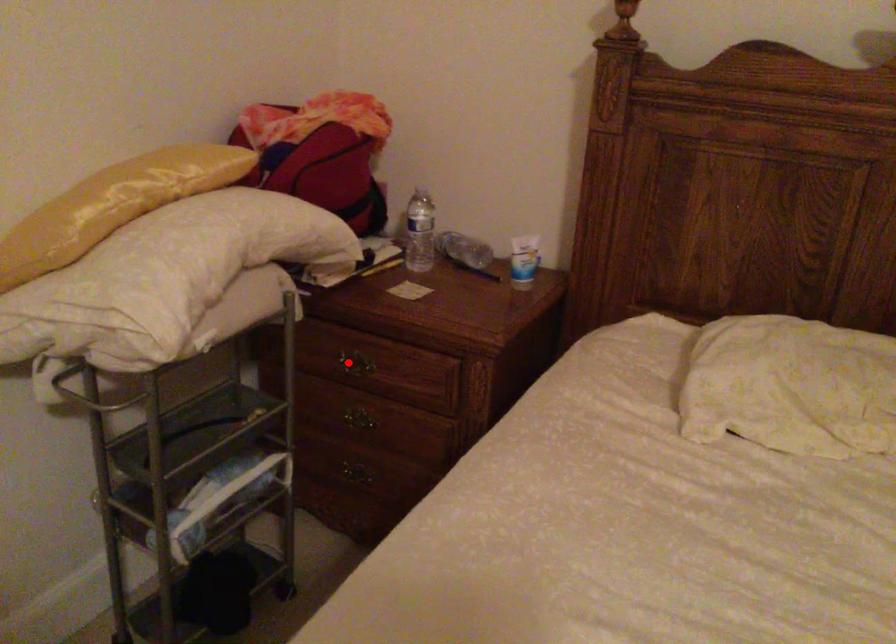
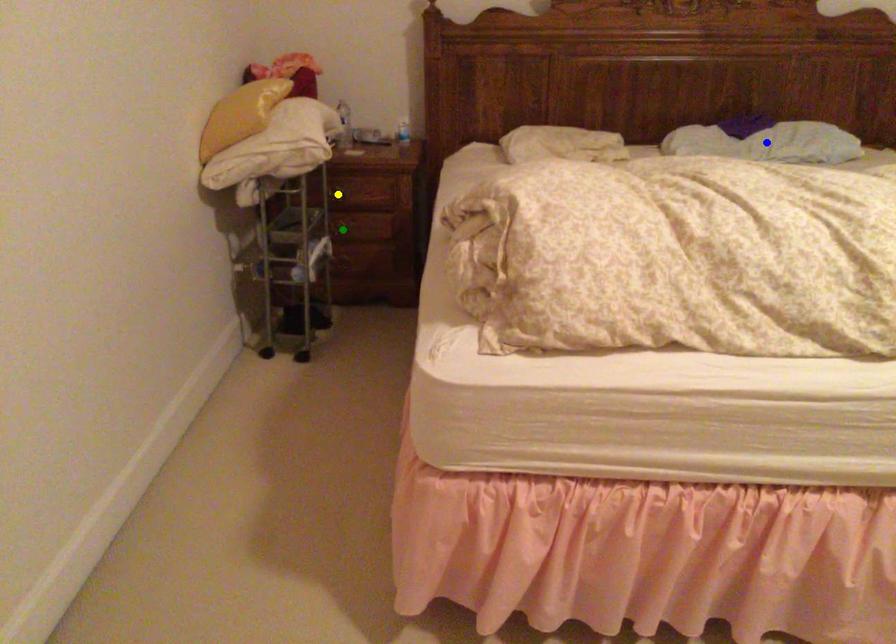
Question: I am providing you with two images of the same scene from different viewpoints. A red point is marked on the first image. You are given multiple points on the second image. Which point in image 2 is actually the same real-world point as the red point in image 1?

Choices:
 (A) blue point
 (B) yellow point
 (C) green point

Answer: (B)